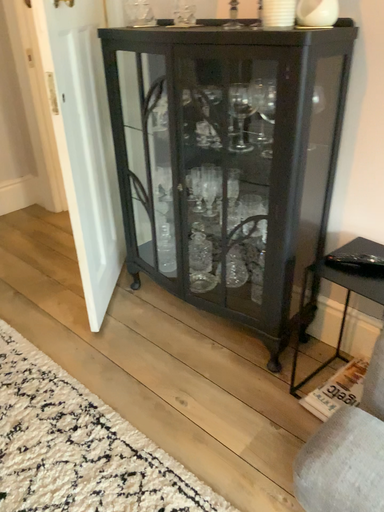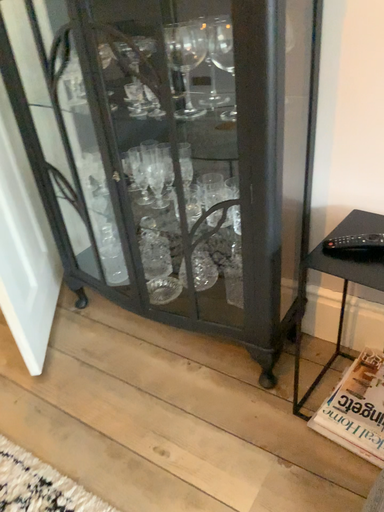
Question: How did the camera likely rotate when shooting the video?

Choices:
 (A) rotated right
 (B) rotated left

Answer: (A)